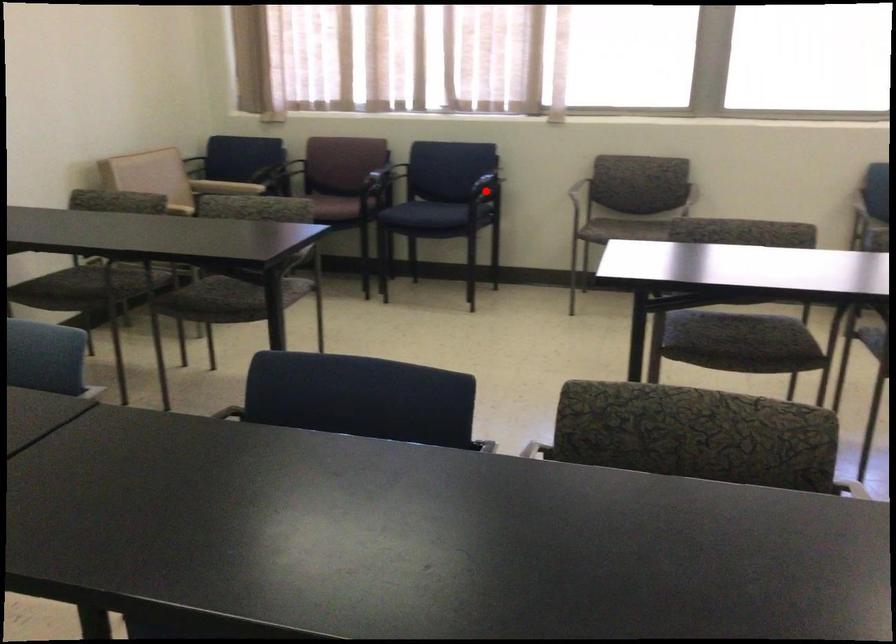
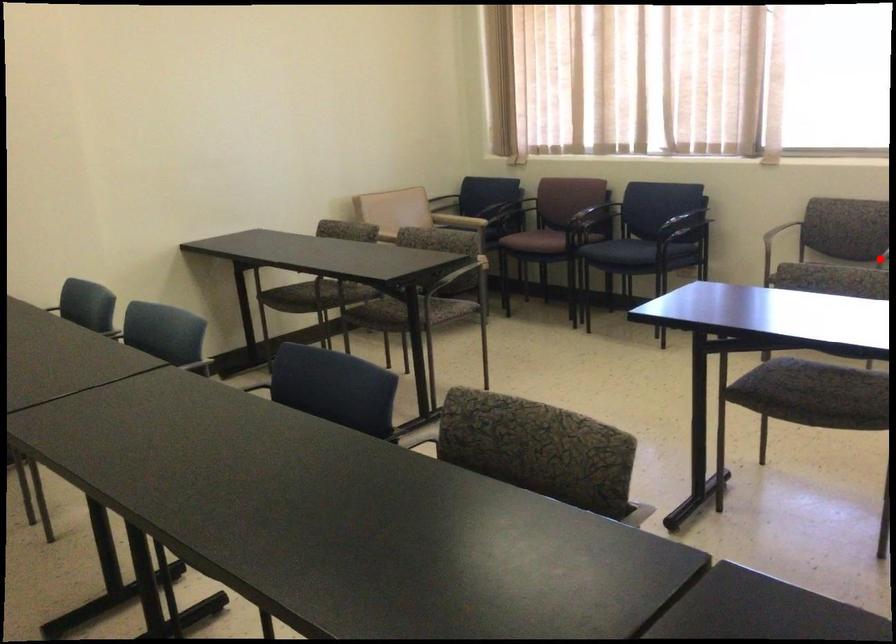
I am providing you with two images of the same scene from different viewpoints. A red point is marked on the first image and another point is marked on the second image. Does the point marked in image1 correspond to the same location as the one in image2?

No